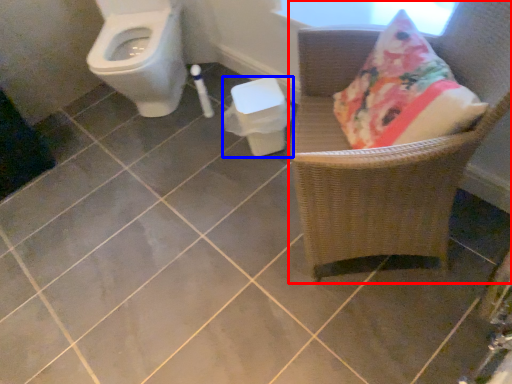
Question: Which of the following is the closest to the observer, chair (highlighted by a red box) or potty (highlighted by a blue box)?

Choices:
 (A) chair
 (B) potty

Answer: (A)